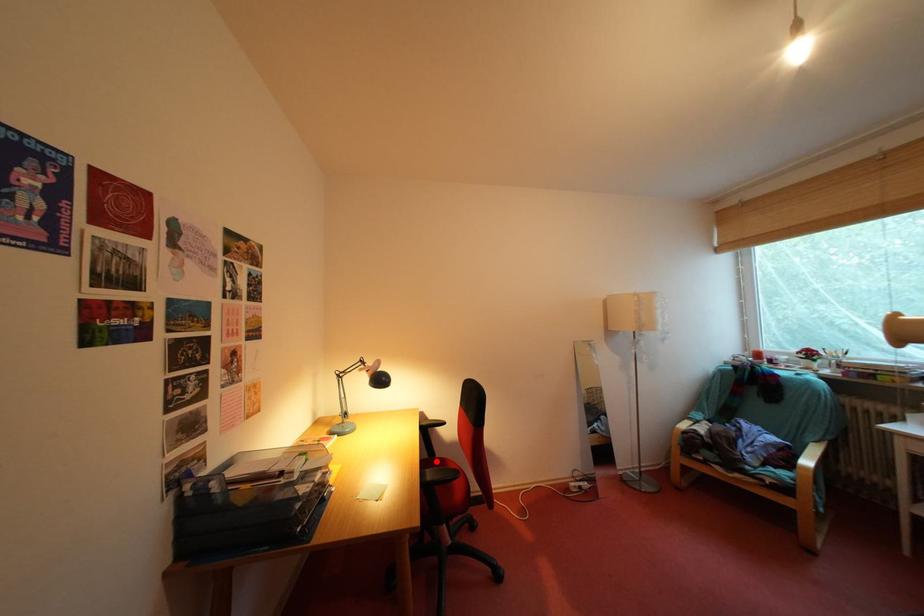
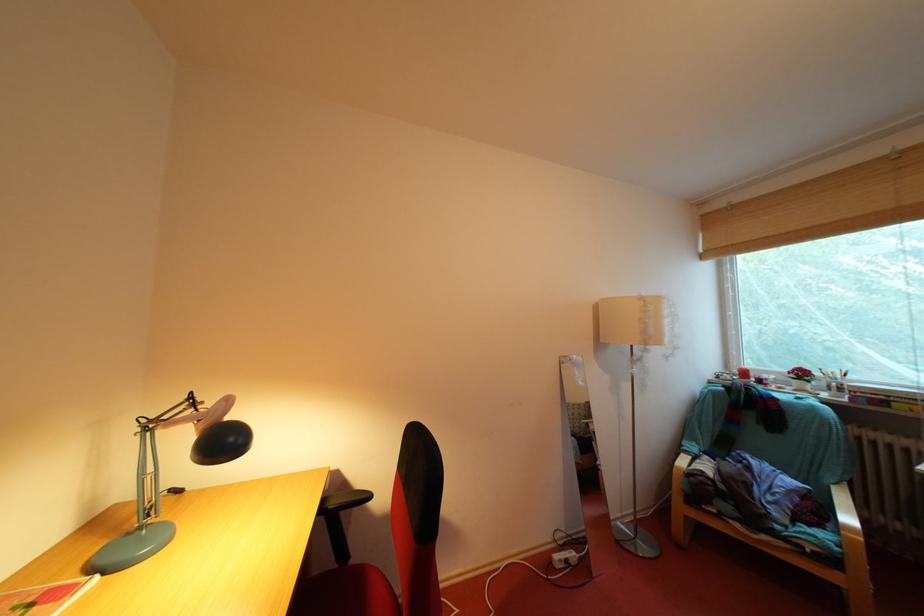
Question: I am providing you with two images of the same scene from different viewpoints. Image1 has a red point marked. In image2, the corresponding 3D location appears at what relative position? Reply with the corresponding letter.

Choices:
 (A) Closer
 (B) Farther

Answer: (A)